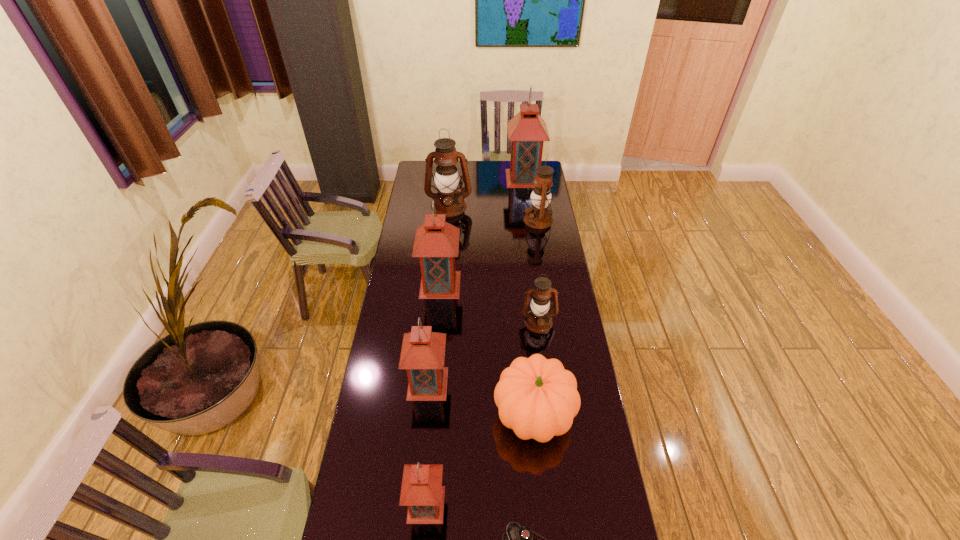
Locate an element on the screen. free space between the farthest lantern and the nearest lantern is located at coordinates (475, 341).

This screenshot has width=960, height=540. What are the coordinates of `empty location between the fifth farthest lantern and the second biggest brown lantern` in the screenshot? It's located at (x=539, y=271).

Image resolution: width=960 pixels, height=540 pixels. I want to click on free point between the nearest brown lantern and the tallest object, so click(x=531, y=250).

Where is `free point between the third nearest lantern and the sixth farthest lantern`? free point between the third nearest lantern and the sixth farthest lantern is located at coordinates (x=483, y=353).

Find the location of a particular element. This screenshot has width=960, height=540. vacant area between the orange pumpkin and the smallest pink lantern is located at coordinates (480, 460).

Identify which object is located as the eighth nearest to the third farthest pink lantern. Please provide its 2D coordinates. Your answer should be formatted as a tuple, i.e. [(x, y)], where the tuple contains the x and y coordinates of a point satisfying the conditions above.

[(527, 131)]

Locate an element on the screen. Image resolution: width=960 pixels, height=540 pixels. object identified as the fifth closest to the nearest brown lantern is located at coordinates (422, 492).

The height and width of the screenshot is (540, 960). What are the coordinates of `lantern that is the fourth closest to the pumpkin` in the screenshot? It's located at (436, 243).

Identify the location of lantern that is the third nearest to the third farthest pink lantern. This screenshot has height=540, width=960. (436, 243).

Locate which pink lantern ranks in proximity to the second nearest pink lantern. Please provide its 2D coordinates. Your answer should be formatted as a tuple, i.e. [(x, y)], where the tuple contains the x and y coordinates of a point satisfying the conditions above.

[(422, 492)]